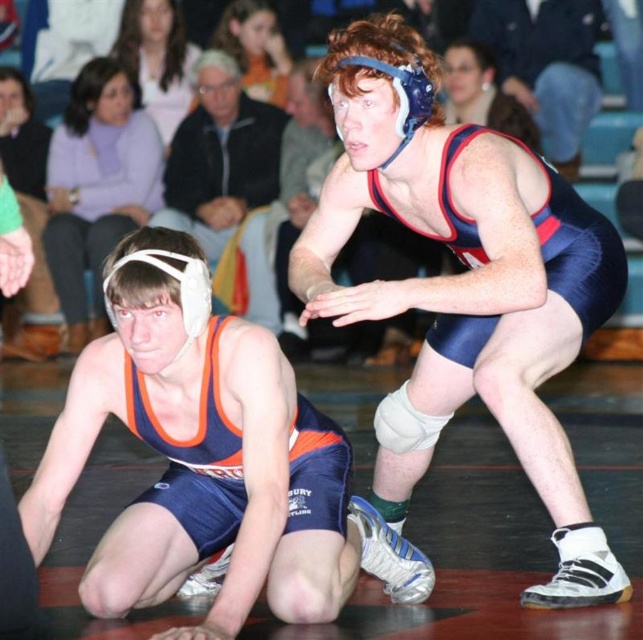
Question: Which object is positioned farthest from the blue fabric wrestling singlet at upper center?

Choices:
 (A) blue/white wrestling singlet at upper right
 (B) blue/orange singlet at lower left

Answer: (B)

Question: Does blue/white wrestling singlet at upper right lie in front of matte blue wrestling singlet at upper center?

Choices:
 (A) no
 (B) yes

Answer: (B)

Question: Which point is closer to the camera taking this photo?

Choices:
 (A) (116, 600)
 (B) (376, 108)
 (C) (231, 212)

Answer: (A)

Question: Which point appears farthest from the camera in this image?

Choices:
 (A) (577, 29)
 (B) (113, 285)
 (C) (509, 252)
 (D) (237, 182)

Answer: (D)

Question: Is blue/orange singlet at lower left to the left of matte blue wrestling singlet at upper center from the viewer's perspective?

Choices:
 (A) yes
 (B) no

Answer: (B)

Question: Is matte blue wrestling singlet at upper center smaller than blue fabric wrestling singlet at upper center?

Choices:
 (A) no
 (B) yes

Answer: (A)